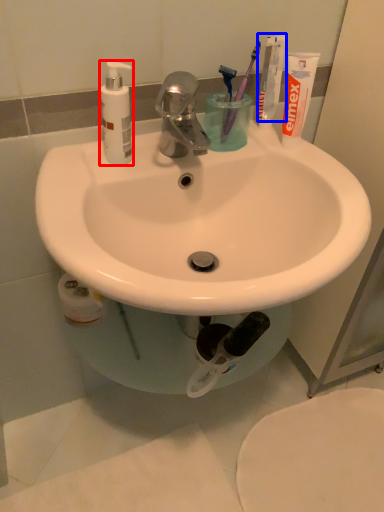
Question: Which object appears closest to the camera in this image, soap dispenser (highlighted by a red box) or toothpaste (highlighted by a blue box)?

Choices:
 (A) soap dispenser
 (B) toothpaste

Answer: (A)